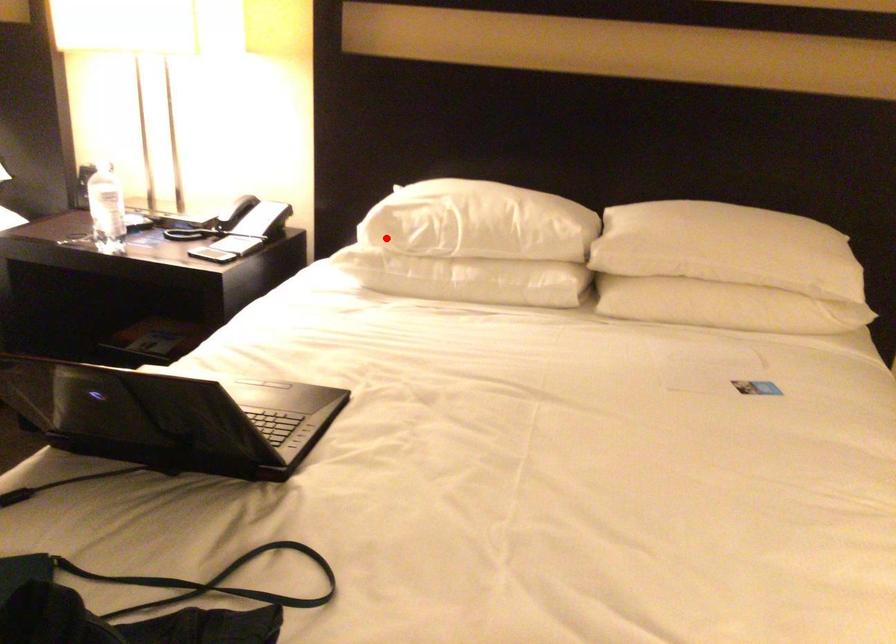
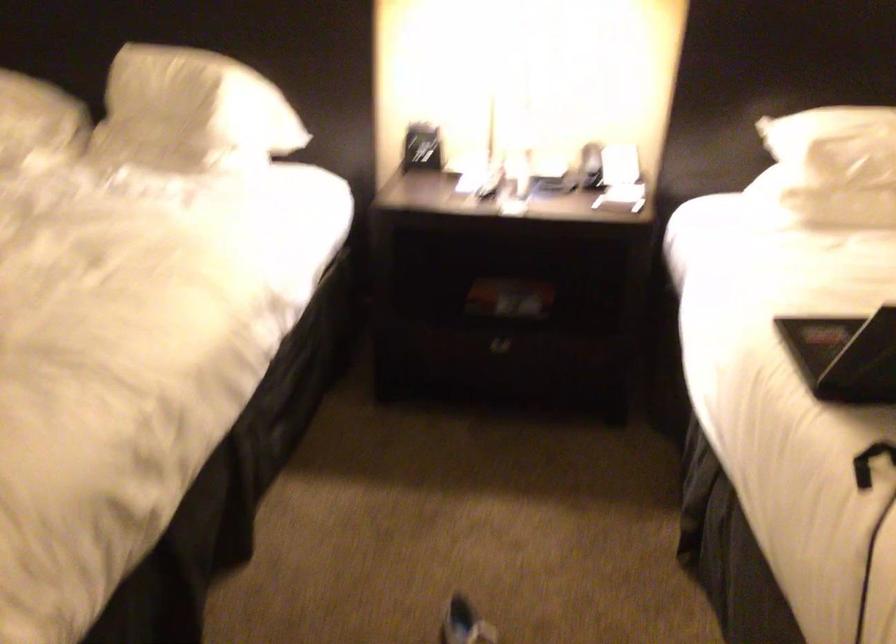
The point at the highlighted location is marked in the first image. Where is the corresponding point in the second image?

(831, 167)